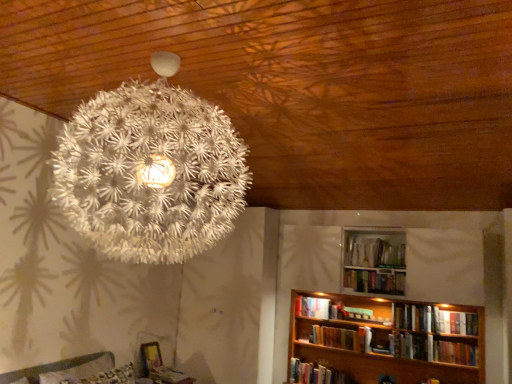
Question: Could hardcover books at upper center, which is counted as the 6th book, starting from the left, be considered to be inside white matte bookshelf at lower right, the sixth book viewed from the right?

Choices:
 (A) yes
 (B) no

Answer: (B)

Question: Considering the relative sizes of white matte bookshelf at lower right, the 3th book positioned from the left, and hardcover books at upper center, the 3th book in the right-to-left sequence, in the image provided, is white matte bookshelf at lower right, the 3th book positioned from the left, taller than hardcover books at upper center, the 3th book in the right-to-left sequence,?

Choices:
 (A) no
 (B) yes

Answer: (B)

Question: Is white matte bookshelf at lower right, the sixth book viewed from the right, to the left of hardcover books at upper center, which is counted as the 6th book, starting from the left, from the viewer's perspective?

Choices:
 (A) no
 (B) yes

Answer: (B)

Question: Does white matte bookshelf at lower right, the 3th book positioned from the left, come in front of hardcover books at upper center, which is counted as the 6th book, starting from the left?

Choices:
 (A) yes
 (B) no

Answer: (B)

Question: From the image's perspective, is white matte bookshelf at lower right, the 3th book positioned from the left, above hardcover books at upper center, which is counted as the 6th book, starting from the left?

Choices:
 (A) no
 (B) yes

Answer: (A)

Question: From the image's perspective, is white matte bookshelf at lower right, the sixth book viewed from the right, below hardcover books at upper center, which is counted as the 6th book, starting from the left?

Choices:
 (A) no
 (B) yes

Answer: (B)

Question: Can you confirm if white textured lamp at upper center is smaller than wooden bookshelf at lower right?

Choices:
 (A) no
 (B) yes

Answer: (A)

Question: Is white textured lamp at upper center located outside wooden bookshelf at lower right?

Choices:
 (A) no
 (B) yes

Answer: (B)

Question: Is white textured lamp at upper center oriented away from wooden bookshelf at lower right?

Choices:
 (A) no
 (B) yes

Answer: (B)

Question: Is white textured lamp at upper center at the left side of wooden bookshelf at lower right?

Choices:
 (A) yes
 (B) no

Answer: (A)

Question: Is white textured lamp at upper center shorter than wooden bookshelf at lower right?

Choices:
 (A) yes
 (B) no

Answer: (B)

Question: Is wooden bookshelf at lower right located within white textured lamp at upper center?

Choices:
 (A) no
 (B) yes

Answer: (A)

Question: Is hardcover book at center, the fourth book when ordered from right to left, looking in the opposite direction of white matte bookshelf at lower right, arranged as the 7th book when viewed from the right?

Choices:
 (A) yes
 (B) no

Answer: (B)